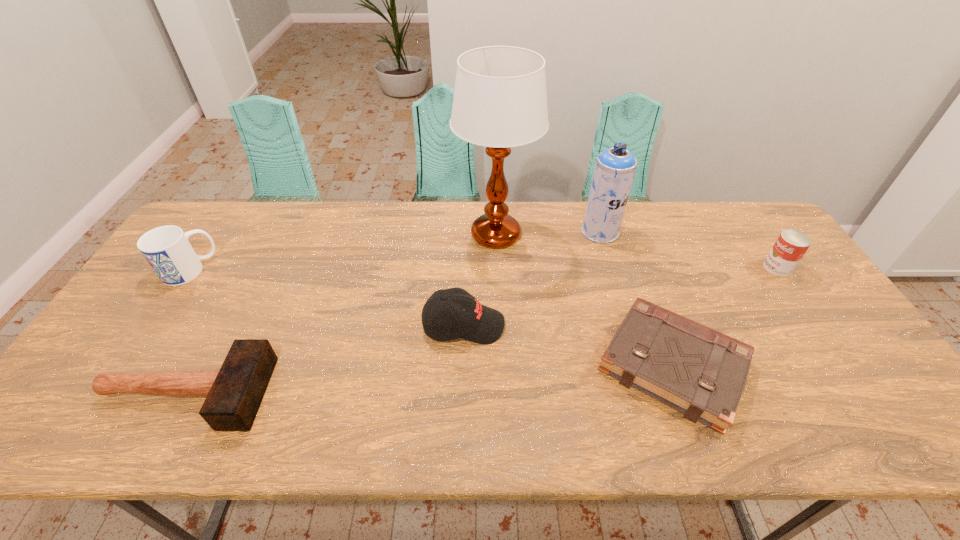
Locate an element on the screen. This screenshot has width=960, height=540. free spot between the mallet and the hardback book is located at coordinates coord(429,379).

Image resolution: width=960 pixels, height=540 pixels. Identify the location of free point between the hardback book and the sixth shortest object. (636, 299).

The width and height of the screenshot is (960, 540). In order to click on free space between the aerosol can and the mug in this screenshot , I will do `click(395, 251)`.

Identify the location of free space between the baseball cap and the aerosol can. This screenshot has height=540, width=960. (532, 279).

At what (x,y) coordinates should I click in order to perform the action: click on vacant space in between the rightmost object and the mug. Please return your answer as a coordinate pair (x, y). This screenshot has width=960, height=540. Looking at the image, I should click on (484, 269).

Identify the location of free spot between the second tallest object and the tallest object. This screenshot has width=960, height=540. (548, 233).

The image size is (960, 540). Identify the location of unoccupied area between the can and the baseball cap. (620, 296).

Find the location of a particular element. Image resolution: width=960 pixels, height=540 pixels. vacant point located between the baseball cap and the rightmost object is located at coordinates (620, 296).

The width and height of the screenshot is (960, 540). Find the location of `object that stands as the fifth closest to the baseball cap`. object that stands as the fifth closest to the baseball cap is located at coordinates (167, 249).

Identify which object is the second nearest to the mallet. Please provide its 2D coordinates. Your answer should be formatted as a tuple, i.e. [(x, y)], where the tuple contains the x and y coordinates of a point satisfying the conditions above.

[(477, 323)]